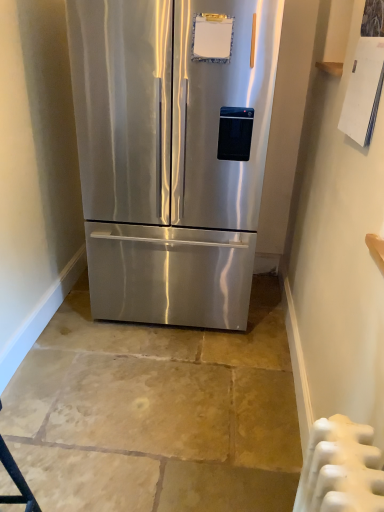
Consider the image. What is the approximate width of stainless steel refrigerator at center?

It is 32.27 inches.

In the scene shown: Measure the distance between point (202, 149) and camera.

The distance of point (202, 149) from camera is 6.49 feet.

Where is `stainless steel refrigerator at center`? The width and height of the screenshot is (384, 512). stainless steel refrigerator at center is located at coordinates (172, 152).

The height and width of the screenshot is (512, 384). Describe the element at coordinates (172, 152) in the screenshot. I see `stainless steel refrigerator at center` at that location.

Identify the location of white plastic radiator at lower right. (340, 468).

What do you see at coordinates (340, 468) in the screenshot?
I see `white plastic radiator at lower right` at bounding box center [340, 468].

Locate an element on the screen. The image size is (384, 512). stainless steel refrigerator at center is located at coordinates (172, 152).

Can you confirm if stainless steel refrigerator at center is positioned to the left of white plastic radiator at lower right?

Correct, you'll find stainless steel refrigerator at center to the left of white plastic radiator at lower right.

Is the depth of stainless steel refrigerator at center less than that of white plastic radiator at lower right?

No, the depth of stainless steel refrigerator at center is greater than that of white plastic radiator at lower right.

Considering the points (156, 149) and (380, 452), which point is in front, point (156, 149) or point (380, 452)?

The point (380, 452) is more forward.

From the image's perspective, is stainless steel refrigerator at center under white plastic radiator at lower right?

Incorrect, from the image's perspective, stainless steel refrigerator at center is higher than white plastic radiator at lower right.

From a real-world perspective, is stainless steel refrigerator at center physically located above or below white plastic radiator at lower right?

In terms of real-world spatial position, stainless steel refrigerator at center is above white plastic radiator at lower right.

Considering the sizes of objects stainless steel refrigerator at center and white plastic radiator at lower right in the image provided, who is thinner, stainless steel refrigerator at center or white plastic radiator at lower right?

With smaller width is white plastic radiator at lower right.

Which of these two, stainless steel refrigerator at center or white plastic radiator at lower right, stands taller?

stainless steel refrigerator at center is taller.

Does stainless steel refrigerator at center have a larger size compared to white plastic radiator at lower right?

Correct, stainless steel refrigerator at center is larger in size than white plastic radiator at lower right.

Would you say stainless steel refrigerator at center is outside white plastic radiator at lower right?

Yes, stainless steel refrigerator at center is outside of white plastic radiator at lower right.

Is stainless steel refrigerator at center not close to white plastic radiator at lower right?

Yes, stainless steel refrigerator at center and white plastic radiator at lower right are located far from each other.

Is white plastic radiator at lower right at the back of stainless steel refrigerator at center?

No, white plastic radiator at lower right is not at the back of stainless steel refrigerator at center.

How far apart are stainless steel refrigerator at center and white plastic radiator at lower right?

stainless steel refrigerator at center is 1.41 meters from white plastic radiator at lower right.

Image resolution: width=384 pixels, height=512 pixels. I want to click on radiator in front of the stainless steel refrigerator at center, so pyautogui.click(x=340, y=468).

Is white plastic radiator at lower right at the right side of stainless steel refrigerator at center?

Indeed, white plastic radiator at lower right is positioned on the right side of stainless steel refrigerator at center.

Which object is further away from the camera taking this photo, white plastic radiator at lower right or stainless steel refrigerator at center?

stainless steel refrigerator at center is further from the camera.

Considering the points (326, 510) and (234, 141), which point is behind, point (326, 510) or point (234, 141)?

The point (234, 141) is more distant.

From the image's perspective, between white plastic radiator at lower right and stainless steel refrigerator at center, which one is located above?

stainless steel refrigerator at center.

From a real-world perspective, is white plastic radiator at lower right on stainless steel refrigerator at center?

No, from a real-world perspective, white plastic radiator at lower right is not above stainless steel refrigerator at center.

Can you confirm if white plastic radiator at lower right is thinner than stainless steel refrigerator at center?

Indeed, white plastic radiator at lower right has a lesser width compared to stainless steel refrigerator at center.

Who is shorter, white plastic radiator at lower right or stainless steel refrigerator at center?

white plastic radiator at lower right is shorter.

Does white plastic radiator at lower right have a smaller size compared to stainless steel refrigerator at center?

Yes, white plastic radiator at lower right is smaller than stainless steel refrigerator at center.

Is white plastic radiator at lower right inside or outside of stainless steel refrigerator at center?

white plastic radiator at lower right exists outside the volume of stainless steel refrigerator at center.

Are white plastic radiator at lower right and stainless steel refrigerator at center far apart?

Yes.

Could you tell me if white plastic radiator at lower right is facing stainless steel refrigerator at center?

No, white plastic radiator at lower right is not oriented towards stainless steel refrigerator at center.

Could you measure the distance between white plastic radiator at lower right and stainless steel refrigerator at center?

white plastic radiator at lower right and stainless steel refrigerator at center are 1.41 meters apart.

You are a GUI agent. You are given a task and a screenshot of the screen. Output one action in this format:
    pyautogui.click(x=<x>, y=<y>)
    Task: Click on the radiator in front of the stainless steel refrigerator at center
    The image size is (384, 512).
    Given the screenshot: What is the action you would take?
    pyautogui.click(x=340, y=468)

I want to click on refrigerator above the white plastic radiator at lower right (from a real-world perspective), so click(172, 152).

The image size is (384, 512). What are the coordinates of `radiator in front of the stainless steel refrigerator at center` in the screenshot? It's located at (340, 468).